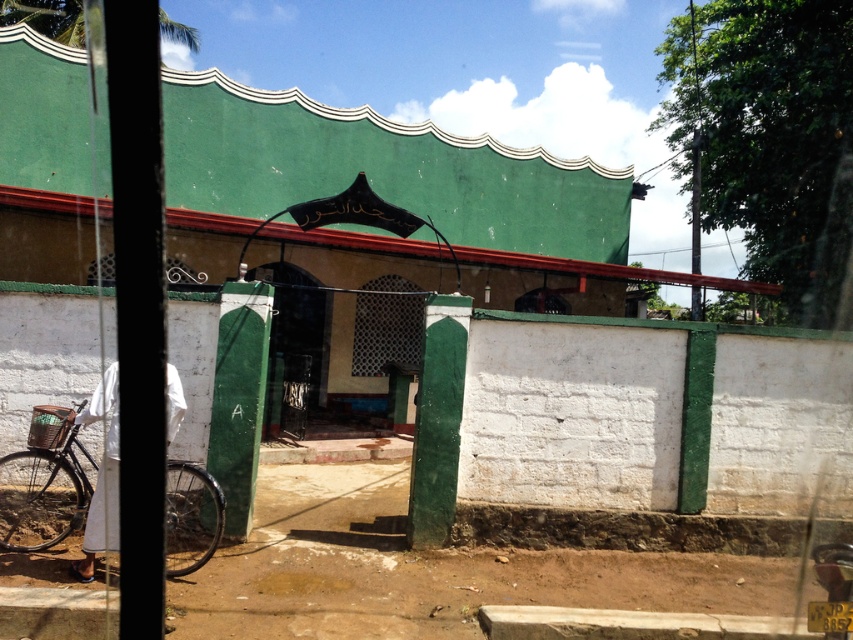
You are a visitor arriving at the mosque and want to park your bicycle. The brown dirt track at lower left is in front of the black matte bicycle at left. Can you park your bicycle behind the existing one without blocking the path?

The brown dirt track at lower left is in front of the black matte bicycle at left, so parking behind the existing bicycle would not block the path as the track is in front of the bicycle.

You are a delivery person trying to park your black matte bicycle at left near the brown dirt track at lower left. Can you fit the bicycle on the dirt track?

The brown dirt track at lower left is smaller than the black matte bicycle at left, so the dirt track is not wide enough to accommodate the bicycle.

You are standing at the entrance of the mosque and want to take a photo of the point at coordinates (596, 577). If your camera has a focal length of 50mm and you need to ensure the point is in focus, what is the minimum distance you should be from the point to capture it clearly?

The point at coordinates (596, 577) is 6.35 meters away from the camera. To ensure it is in focus, you should maintain a distance of at least 6.35 meters from the point.